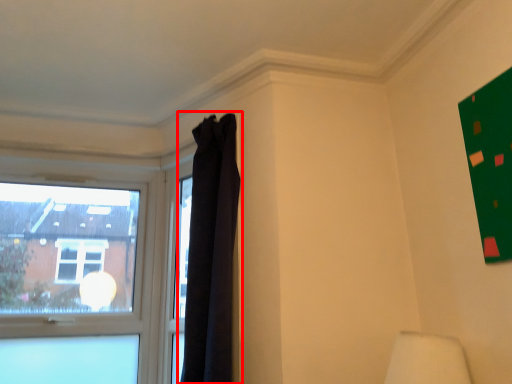
Question: Where is curtain (annotated by the red box) located in relation to window in the image?

Choices:
 (A) left
 (B) right

Answer: (B)